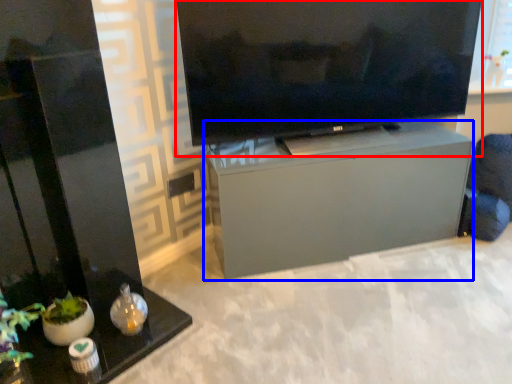
Question: Which of the following is the closest to the observer, television (highlighted by a red box) or furniture (highlighted by a blue box)?

Choices:
 (A) television
 (B) furniture

Answer: (A)